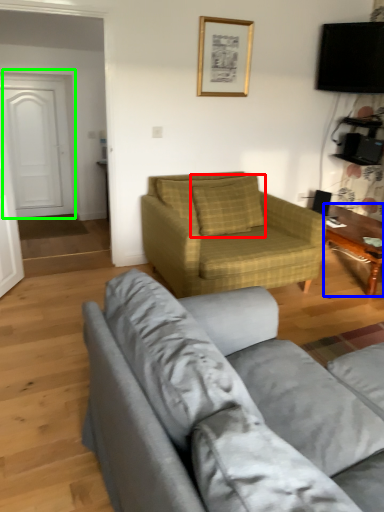
Question: Which object is positioned closest to pillow (highlighted by a red box)? Select from coffee table (highlighted by a blue box) and door (highlighted by a green box).

Choices:
 (A) coffee table
 (B) door

Answer: (A)